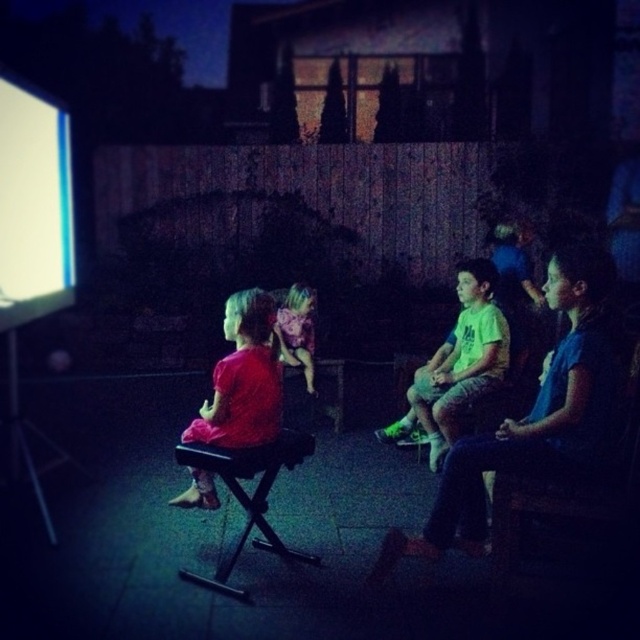
Can you confirm if white glossy projection screen at left is smaller than black plastic stool at lower left?

Correct, white glossy projection screen at left occupies less space than black plastic stool at lower left.

Is point (67, 161) positioned before point (266, 508)?

That is False.

Where is `white glossy projection screen at left`? white glossy projection screen at left is located at coordinates (33, 205).

Can you confirm if dark blue jeans at right is positioned to the right of white glossy projection screen at left?

Correct, you'll find dark blue jeans at right to the right of white glossy projection screen at left.

Which is behind, point (465, 522) or point (6, 173)?

Positioned behind is point (6, 173).

Find the location of a particular element. The image size is (640, 640). dark blue jeans at right is located at coordinates (532, 416).

Based on the photo, who is positioned more to the left, matte pink dress at center or black plastic stool at lower left?

matte pink dress at center

This screenshot has width=640, height=640. Describe the element at coordinates (243, 378) in the screenshot. I see `matte pink dress at center` at that location.

In order to click on matte pink dress at center in this screenshot , I will do `click(243, 378)`.